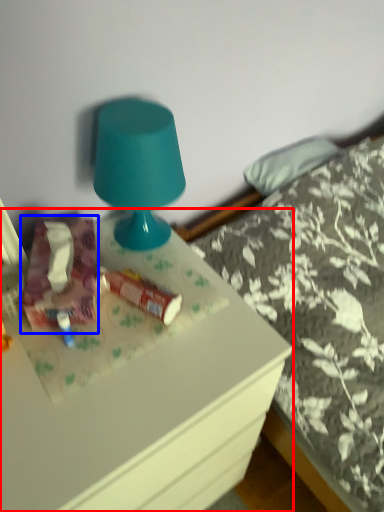
Question: Which object is further to the camera taking this photo, desk (highlighted by a red box) or stuff (highlighted by a blue box)?

Choices:
 (A) desk
 (B) stuff

Answer: (B)